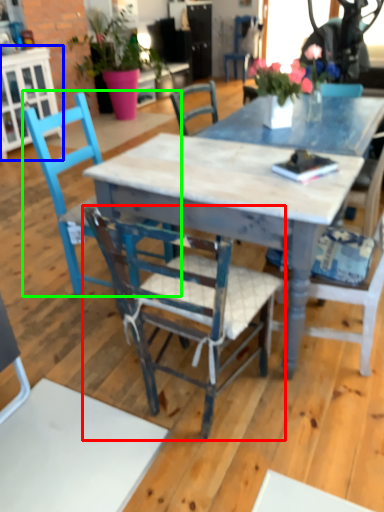
Question: Which is nearer to the chair (highlighted by a red box)? cabinetry (highlighted by a blue box) or chair (highlighted by a green box).

Choices:
 (A) cabinetry
 (B) chair

Answer: (B)